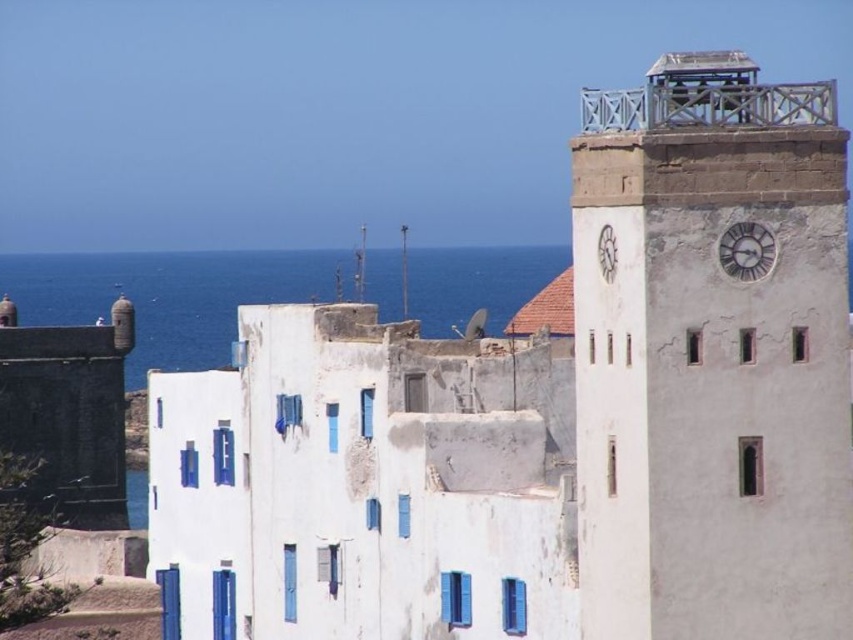
You are standing at the camera position and want to take a photo of the light brown stone clock tower at upper right. If your camera has a maximum zoom range of 50 meters, will you be able to capture the entire tower in the photo?

The light brown stone clock tower at upper right and camera are 65.64 meters apart. Since the camera can only zoom up to 50 meters, you won wait be able to capture the entire tower in the photo.

You are an architect planning to install a decorative banner between the light brown stone clock tower at upper right and the white matte clock at upper right. The banner requires a minimum of 3 meters of space between the two points to be properly displayed. Based on the scene, will the banner fit?

The light brown stone clock tower at upper right and white matte clock at upper right are 3.43 meters apart from each other, which is more than the required 3 meters. Therefore, the banner will fit between them.

You are standing at the center of the coastal scene. You want to find the blue water at left. Which direction should you face to see it?

The blue water at left is located at point coordinates of 0.463 on the x axis and 0.199 on the y axis. Since the coordinates are in the lower left quadrant, you should face to the left direction to see it.